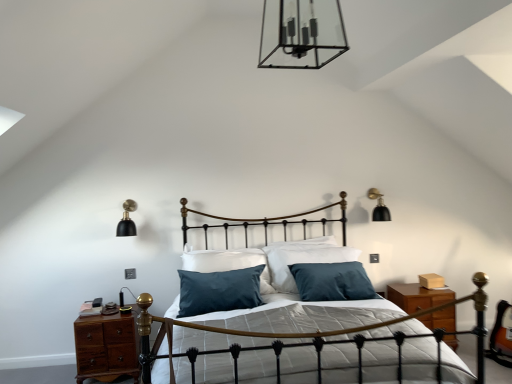
Where is `black matte wall sconce at left, which ranks as the second light fixture in back-to-front order`? Image resolution: width=512 pixels, height=384 pixels. black matte wall sconce at left, which ranks as the second light fixture in back-to-front order is located at coordinates (127, 220).

The image size is (512, 384). Describe the element at coordinates (127, 220) in the screenshot. I see `black matte wall sconce at left, which ranks as the second light fixture in back-to-front order` at that location.

Measure the distance between point (129, 355) and camera.

3.11 meters.

Locate an element on the screen. The width and height of the screenshot is (512, 384). brown wood nightstand at left is located at coordinates (106, 346).

Describe the element at coordinates (307, 316) in the screenshot. The image size is (512, 384). I see `gold wrought iron bed frame at center` at that location.

What do you see at coordinates (379, 206) in the screenshot? The width and height of the screenshot is (512, 384). I see `black matte wall sconce at upper right, the 1th light fixture viewed from the right` at bounding box center [379, 206].

What are the coordinates of `teal fabric pillow at center` in the screenshot? It's located at (302, 261).

You are a GUI agent. You are given a task and a screenshot of the screen. Output one action in this format:
    pyautogui.click(x=<x>, y=<y>)
    Task: Click on the black matte wall sconce at left, acting as the second light fixture starting from the front
    The height and width of the screenshot is (384, 512).
    Given the screenshot: What is the action you would take?
    pyautogui.click(x=127, y=220)

Is black matte wall sconce at left, arranged as the first light fixture when viewed from the left, looking in the opposite direction of brown wood nightstand at left?

black matte wall sconce at left, arranged as the first light fixture when viewed from the left, is not turned away from brown wood nightstand at left.

Does black matte wall sconce at left, placed as the first light fixture when sorted from bottom to top, have a smaller size compared to brown wood nightstand at left?

Yes.

From a real-world perspective, which is physically above, black matte wall sconce at left, the 3th light fixture when ordered from top to bottom, or brown wood nightstand at left?

black matte wall sconce at left, the 3th light fixture when ordered from top to bottom.

Measure the distance between black matte wall sconce at left, which ranks as the second light fixture in back-to-front order, and brown wood nightstand at left.

black matte wall sconce at left, which ranks as the second light fixture in back-to-front order, and brown wood nightstand at left are 33.12 inches apart from each other.

Is gold wrought iron bed frame at center oriented towards clear glass chandelier at upper center, arranged as the 3th light fixture when ordered from the bottom?

No, gold wrought iron bed frame at center is not oriented towards clear glass chandelier at upper center, arranged as the 3th light fixture when ordered from the bottom.

From the image's perspective, is gold wrought iron bed frame at center on top of clear glass chandelier at upper center, the second light fixture positioned from the right?

No, from the image's perspective, gold wrought iron bed frame at center is not above clear glass chandelier at upper center, the second light fixture positioned from the right.

Is gold wrought iron bed frame at center not close to clear glass chandelier at upper center, arranged as the 3th light fixture when ordered from the bottom?

Yes.

Does gold wrought iron bed frame at center appear on the right side of clear glass chandelier at upper center, positioned as the 1th light fixture in front-to-back order?

Yes.

Could you tell me if black matte wall sconce at upper right, the third light fixture positioned from the front, is turned towards gold wrought iron bed frame at center?

No, black matte wall sconce at upper right, the third light fixture positioned from the front, is not aimed at gold wrought iron bed frame at center.

Between black matte wall sconce at upper right, the third light fixture positioned from the front, and gold wrought iron bed frame at center, which one is positioned in front?

gold wrought iron bed frame at center is in front.

Visually, is black matte wall sconce at upper right, the 1th light fixture from the back, positioned to the left or to the right of gold wrought iron bed frame at center?

From the image, it's evident that black matte wall sconce at upper right, the 1th light fixture from the back, is to the right of gold wrought iron bed frame at center.

Does gold wrought iron bed frame at center have a smaller size compared to black matte wall sconce at upper right, which is the third light fixture in left-to-right order?

No, gold wrought iron bed frame at center is not smaller than black matte wall sconce at upper right, which is the third light fixture in left-to-right order.

Is gold wrought iron bed frame at center wider than black matte wall sconce at upper right, which is the third light fixture in left-to-right order?

Yes.

In terms of height, does gold wrought iron bed frame at center look taller or shorter compared to black matte wall sconce at upper right, which is counted as the second light fixture, starting from the bottom?

Considering their sizes, gold wrought iron bed frame at center has more height than black matte wall sconce at upper right, which is counted as the second light fixture, starting from the bottom.

Are gold wrought iron bed frame at center and black matte wall sconce at upper right, the 1th light fixture from the back, making contact?

No, gold wrought iron bed frame at center is not touching black matte wall sconce at upper right, the 1th light fixture from the back.

From a real-world perspective, is teal fabric pillow at center above or below gold wrought iron bed frame at center?

From a real-world perspective, teal fabric pillow at center is physically above gold wrought iron bed frame at center.

Between teal fabric pillow at center and gold wrought iron bed frame at center, which one has smaller size?

With smaller size is teal fabric pillow at center.

Considering the positions of objects teal fabric pillow at center and gold wrought iron bed frame at center in the image provided, who is more to the left, teal fabric pillow at center or gold wrought iron bed frame at center?

gold wrought iron bed frame at center.

Is point (323, 249) closer to viewer compared to point (228, 377)?

That is False.

Is clear glass chandelier at upper center, which ranks as the third light fixture in back-to-front order, closer to the viewer compared to brown wood nightstand at left?

Yes, it is.

Based on the photo, what's the angular difference between clear glass chandelier at upper center, arranged as the 3th light fixture when ordered from the bottom, and brown wood nightstand at left's facing directions?

2.87 degrees separate the facing orientations of clear glass chandelier at upper center, arranged as the 3th light fixture when ordered from the bottom, and brown wood nightstand at left.

In the scene shown: From a real-world perspective, is clear glass chandelier at upper center, which ranks as the third light fixture in back-to-front order, positioned above or below brown wood nightstand at left?

clear glass chandelier at upper center, which ranks as the third light fixture in back-to-front order, is situated higher than brown wood nightstand at left in the real world.

Is gold wrought iron bed frame at center looking in the opposite direction of brown wood nightstand at left?

No, gold wrought iron bed frame at center is not facing the opposite direction of brown wood nightstand at left.

Which is more to the left, gold wrought iron bed frame at center or brown wood nightstand at left?

Positioned to the left is brown wood nightstand at left.

I want to click on bed frame above the brown wood nightstand at left (from a real-world perspective), so click(x=307, y=316).

This screenshot has height=384, width=512. There is a brown wood nightstand at left. Identify the location of the 2nd light fixture above it (from a real-world perspective). (127, 220).

The width and height of the screenshot is (512, 384). In order to click on bed frame below the clear glass chandelier at upper center, placed as the first light fixture when sorted from top to bottom (from a real-world perspective) in this screenshot , I will do `click(307, 316)`.

Looking at the image, which one is located closer to gold wrought iron bed frame at center, clear glass chandelier at upper center, which ranks as the third light fixture in back-to-front order, or black matte wall sconce at upper right, placed as the 2th light fixture when sorted from top to bottom?

black matte wall sconce at upper right, placed as the 2th light fixture when sorted from top to bottom, lies closer to gold wrought iron bed frame at center than the other object.

Consider the image. When comparing their distances from brown wood nightstand at left, does teal fabric pillow at center or black matte wall sconce at upper right, the 1th light fixture from the back, seem further?

Among the two, black matte wall sconce at upper right, the 1th light fixture from the back, is located further to brown wood nightstand at left.

Estimate the real-world distances between objects in this image. Which object is further from black matte wall sconce at upper right, the 1th light fixture viewed from the right, gold wrought iron bed frame at center or black matte wall sconce at left, acting as the second light fixture starting from the front?

Among the two, black matte wall sconce at left, acting as the second light fixture starting from the front, is located further to black matte wall sconce at upper right, the 1th light fixture viewed from the right.

Which object lies nearer to the anchor point black matte wall sconce at left, acting as the second light fixture starting from the front, gold wrought iron bed frame at center or brown wood nightstand at left?

The object closer to black matte wall sconce at left, acting as the second light fixture starting from the front, is brown wood nightstand at left.

Estimate the real-world distances between objects in this image. Which object is further from teal fabric pillow at center, clear glass chandelier at upper center, placed as the first light fixture when sorted from top to bottom, or gold wrought iron bed frame at center?

The object further to teal fabric pillow at center is clear glass chandelier at upper center, placed as the first light fixture when sorted from top to bottom.

Looking at the image, which one is located further to black matte wall sconce at upper right, the third light fixture positioned from the front, teal fabric pillow at center or clear glass chandelier at upper center, acting as the 2th light fixture starting from the left?

clear glass chandelier at upper center, acting as the 2th light fixture starting from the left.

When comparing their distances from gold wrought iron bed frame at center, does black matte wall sconce at left, which ranks as the second light fixture in back-to-front order, or brown wood nightstand at left seem further?

black matte wall sconce at left, which ranks as the second light fixture in back-to-front order, is further to gold wrought iron bed frame at center.

Estimate the real-world distances between objects in this image. Which object is closer to brown wood nightstand at left, clear glass chandelier at upper center, which ranks as the third light fixture in back-to-front order, or teal fabric pillow at center?

Based on the image, teal fabric pillow at center appears to be nearer to brown wood nightstand at left.

At what (x,y) coordinates should I click in order to perform the action: click on bed frame between clear glass chandelier at upper center, positioned as the 1th light fixture in front-to-back order, and black matte wall sconce at left, arranged as the first light fixture when viewed from the left, along the z-axis. Please return your answer as a coordinate pair (x, y). This screenshot has width=512, height=384. Looking at the image, I should click on (307, 316).

Find the location of a particular element. bed frame between clear glass chandelier at upper center, positioned as the 1th light fixture in front-to-back order, and brown wood nightstand at left in the up-down direction is located at coordinates (307, 316).

Where is `bed frame between brown wood nightstand at left and teal fabric pillow at center in the horizontal direction`? bed frame between brown wood nightstand at left and teal fabric pillow at center in the horizontal direction is located at coordinates (307, 316).

Locate an element on the screen. This screenshot has height=384, width=512. pillow between clear glass chandelier at upper center, placed as the first light fixture when sorted from top to bottom, and black matte wall sconce at left, which ranks as the second light fixture in back-to-front order, from front to back is located at coordinates (302, 261).